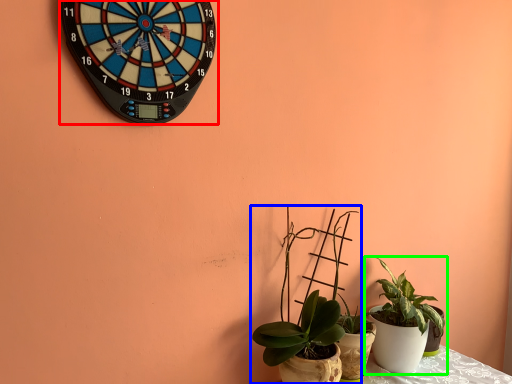
Question: Considering the real-world distances, which object is farthest from wall clock (highlighted by a red box)? houseplant (highlighted by a blue box) or houseplant (highlighted by a green box)?

Choices:
 (A) houseplant
 (B) houseplant

Answer: (B)